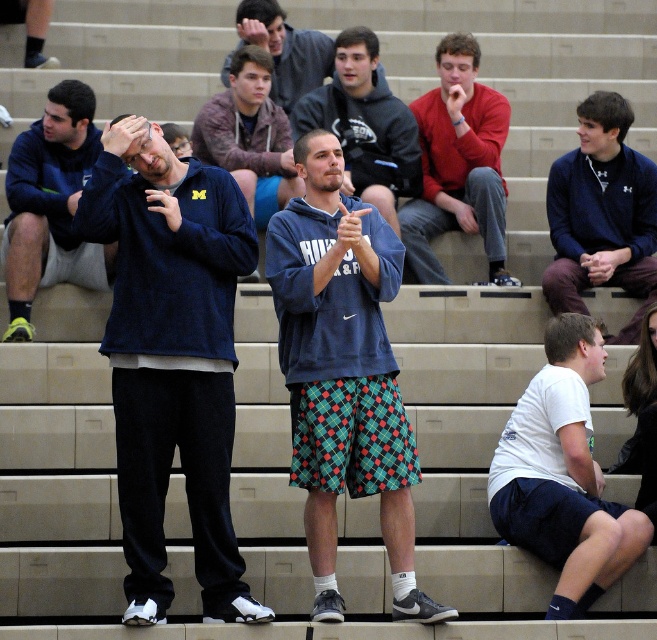
Question: Which is nearer to the plaid shorts at center?

Choices:
 (A) matte blue sweatshirt at center
 (B) blue fleece jacket at upper right
 (C) white cotton shirt at lower right
 (D) blue fleece sweatshirt at center

Answer: (D)

Question: Which of the following is the farthest from the observer?

Choices:
 (A) plaid shorts at center
 (B) red fleece sweatshirt at center

Answer: (A)

Question: Which object is the closest to the blue fleece sweatshirt at center?

Choices:
 (A) red fleece sweatshirt at center
 (B) white cotton shirt at lower right
 (C) blue fleece hoodie at center
 (D) blue fleece jacket at upper right

Answer: (A)

Question: Is white cotton shirt at lower right further to the viewer compared to matte blue sweatshirt at center?

Choices:
 (A) no
 (B) yes

Answer: (A)

Question: Does blue fleece hoodie at center have a greater width compared to blue fleece jacket at upper right?

Choices:
 (A) yes
 (B) no

Answer: (B)

Question: Does dark blue fleece sweatshirt at left appear under matte blue sweatshirt at center?

Choices:
 (A) no
 (B) yes

Answer: (B)